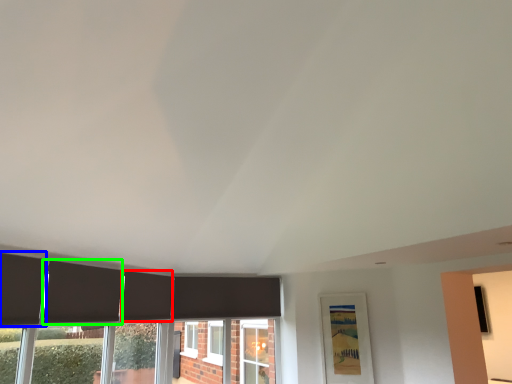
Question: Which object is the closest to the curtain (highlighted by a red box)? Choose among these: curtain (highlighted by a blue box) or curtain (highlighted by a green box).

Choices:
 (A) curtain
 (B) curtain

Answer: (B)